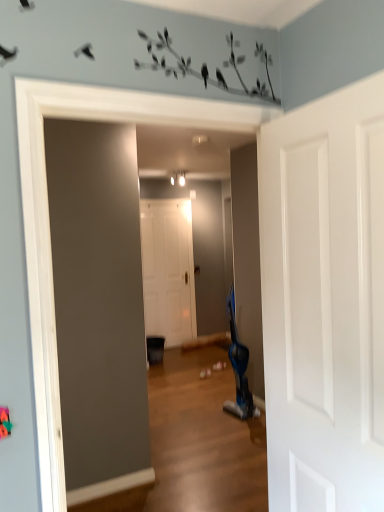
Image resolution: width=384 pixels, height=512 pixels. I want to click on vacant space in front of blue plastic swivel chair at center-right, so click(240, 423).